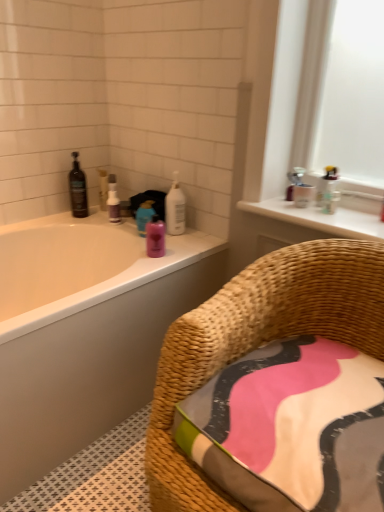
At what (x,y) coordinates should I click in order to perform the action: click on free space in front of pink glossy bottle at upper center, acting as the 1th toiletry starting from the bottom. Please return your answer as a coordinate pair (x, y). This screenshot has height=512, width=384. Looking at the image, I should click on (147, 265).